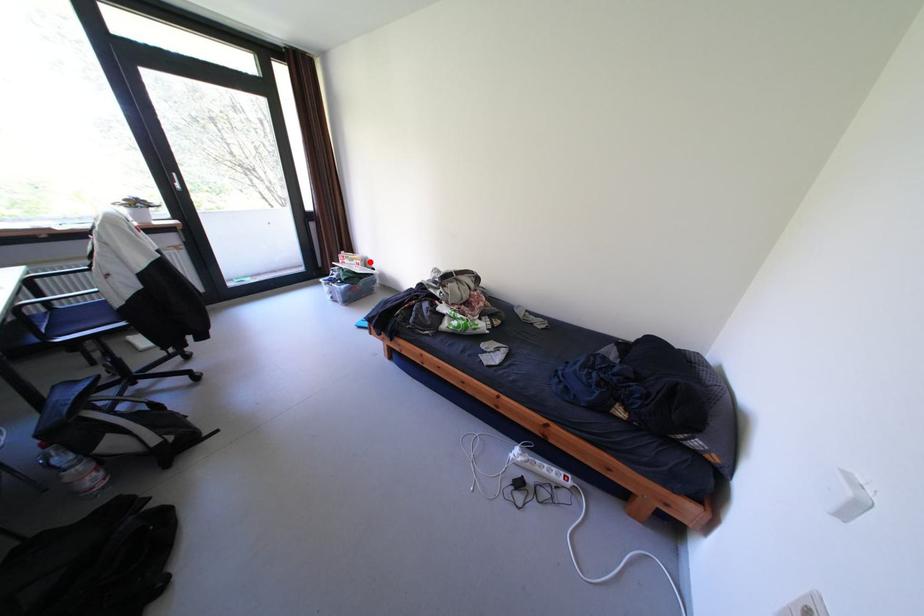
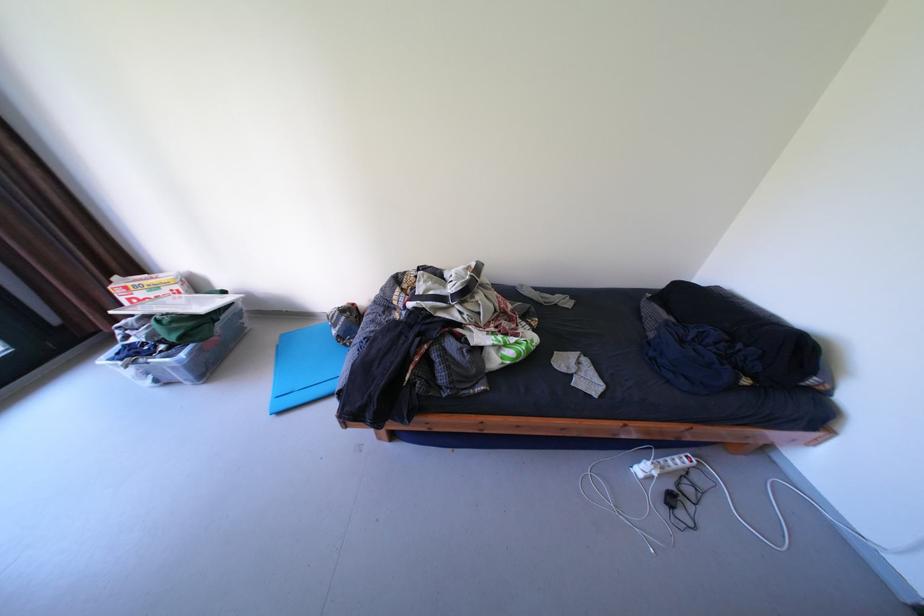
Question: A red point is marked in image1. In image2, is the corresponding 3D point closer to the camera or farther? Reply with the corresponding letter.

Choices:
 (A) The corresponding 3D point is closer.
 (B) The corresponding 3D point is farther.

Answer: (B)